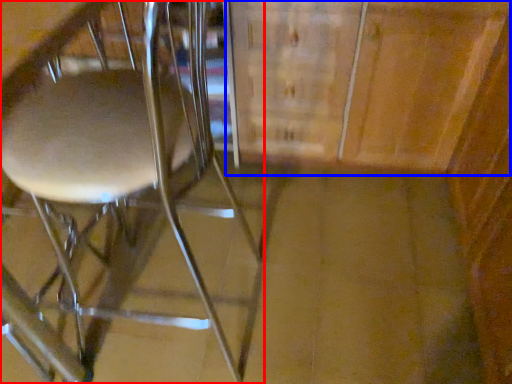
Question: Which object is closer to the camera taking this photo, chair (highlighted by a red box) or cabinetry (highlighted by a blue box)?

Choices:
 (A) chair
 (B) cabinetry

Answer: (A)